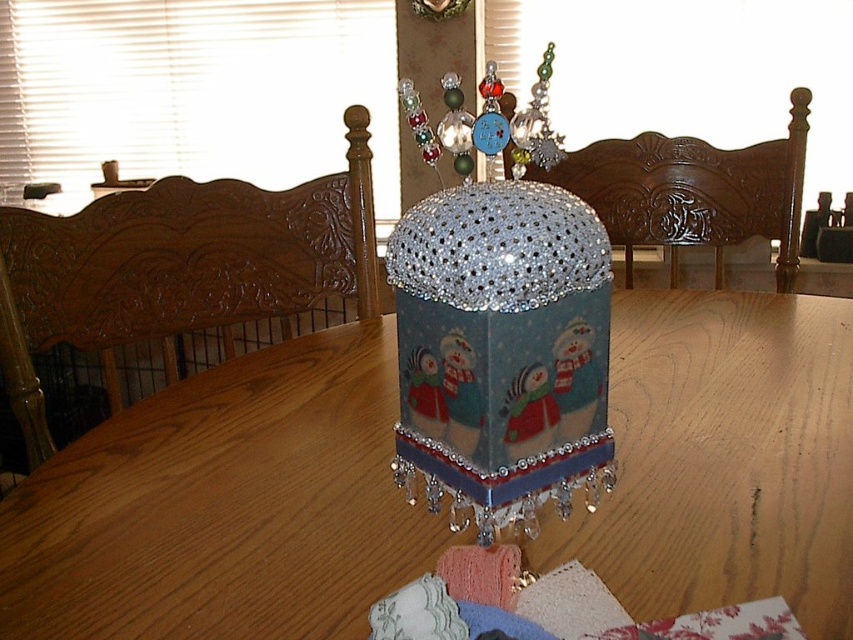
Question: Does wooden table at center appear on the left side of glittery plastic snowman at center?

Choices:
 (A) no
 (B) yes

Answer: (A)

Question: Which of the following is the farthest from the observer?

Choices:
 (A) (830, 417)
 (B) (552, 419)

Answer: (A)

Question: Does wooden table at center appear on the left side of glittery plastic snowman at center?

Choices:
 (A) no
 (B) yes

Answer: (A)

Question: Which of the following is the closest to the observer?

Choices:
 (A) wooden table at center
 (B) glittery plastic snowman at center

Answer: (B)

Question: Does wooden table at center have a larger size compared to glittery plastic snowman at center?

Choices:
 (A) yes
 (B) no

Answer: (A)